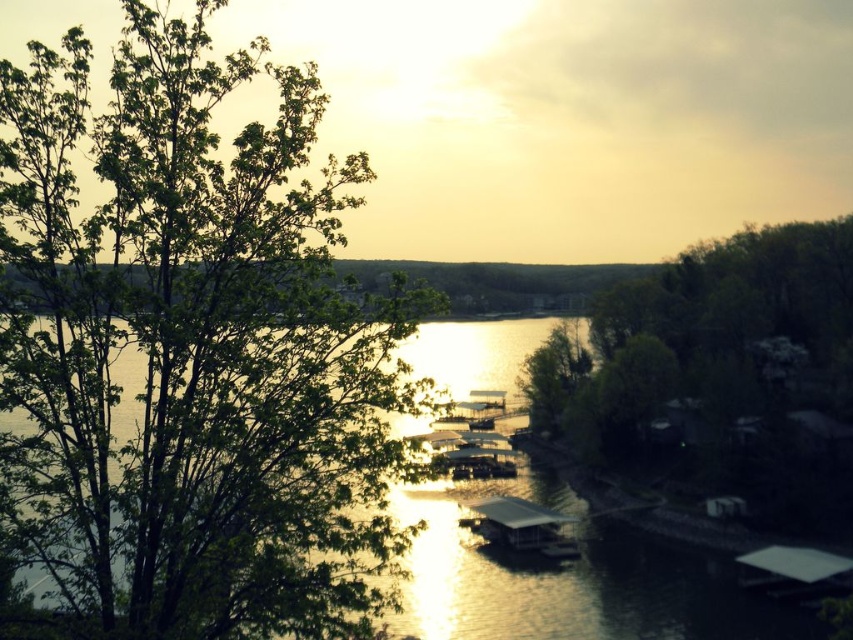
In the scene shown: You are standing at the lakeside and want to determine which of the two points, point (236, 148) or point (514, 500), is closer to you. Based on the scene description, which point is nearer?

Point (236, 148) is closer to the viewer than point (514, 500).

You are standing at the lakeside and want to take a photo of the glistening water at center without the green leafy tree at center blocking the view. Is the tree too tall to block the water in your photo?

The green leafy tree at center has a greater height compared to glistening water at center, so the tree is taller and may block the view of the water in your photo.

You are an observer standing at the lakeside. You see the green leafy tree at center and the glistening water at center. Which object is closer to you?

The green leafy tree at center is closer to you because it is in front of the glistening water at center.